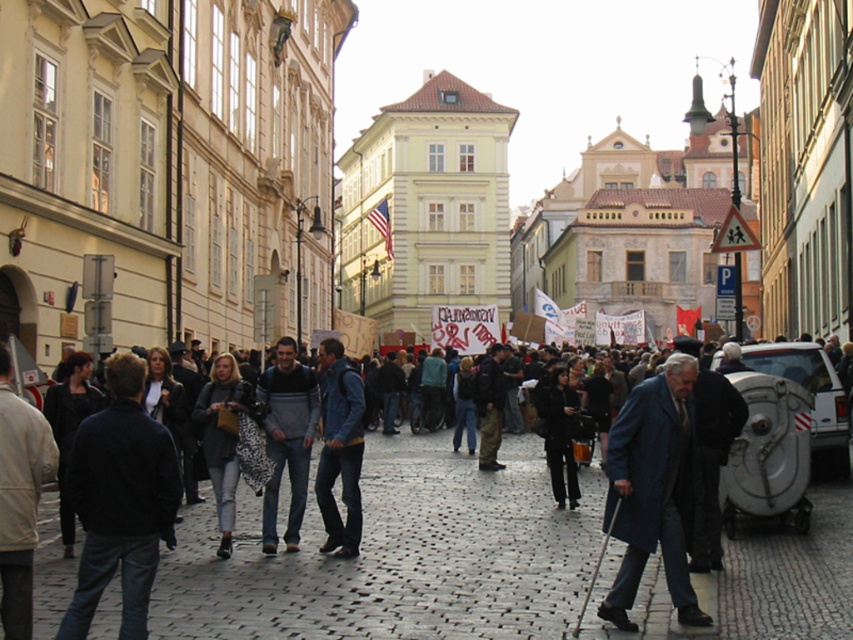
You are a photographer standing on the bustling urban street scene. You see a denim jacket at center and a black fabric coat at center. Which clothing item is positioned closer to your camera lens?

The denim jacket at center is closer to the viewer than the black fabric coat at center, so the denim jacket at center would be positioned closer to the camera lens.

You are a delivery person trying to navigate through the busy street. You need to pass between the cobblestone pavement at center and the light beige jacket at left. Can you estimate if there is enough space for your delivery cart?

The cobblestone pavement at center is wider than the light beige jacket at left, so there should be sufficient space for your delivery cart to pass between them.